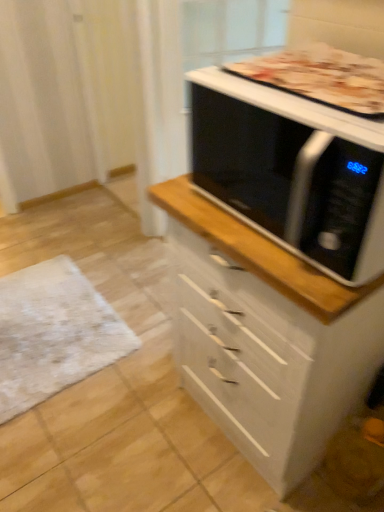
Question: From the image's perspective, relative to golden brown crust at upper right, is black glossy microwave at upper right above or below?

Choices:
 (A) above
 (B) below

Answer: (B)

Question: Considering the positions of black glossy microwave at upper right and golden brown crust at upper right in the image, is black glossy microwave at upper right taller or shorter than golden brown crust at upper right?

Choices:
 (A) tall
 (B) short

Answer: (A)

Question: Estimate the real-world distances between objects in this image. Which object is closer to the black glossy microwave at upper right?

Choices:
 (A) white textured mat at lower left
 (B) white glossy chest of drawers at center
 (C) golden brown crust at upper right

Answer: (C)

Question: Which object is positioned closest to the golden brown crust at upper right?

Choices:
 (A) black glossy microwave at upper right
 (B) white textured mat at lower left
 (C) white glossy chest of drawers at center

Answer: (A)